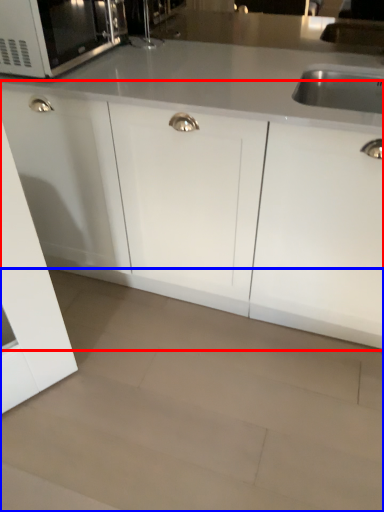
Question: Which of the following is the farthest to the observer, cabinetry (highlighted by a red box) or granite (highlighted by a blue box)?

Choices:
 (A) cabinetry
 (B) granite

Answer: (A)